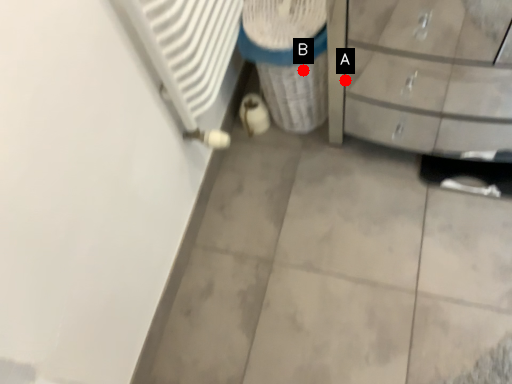
Question: Two points are circled on the image, labeled by A and B beside each circle. Which point is farther from the camera taking this photo?

Choices:
 (A) A is further
 (B) B is further

Answer: (A)